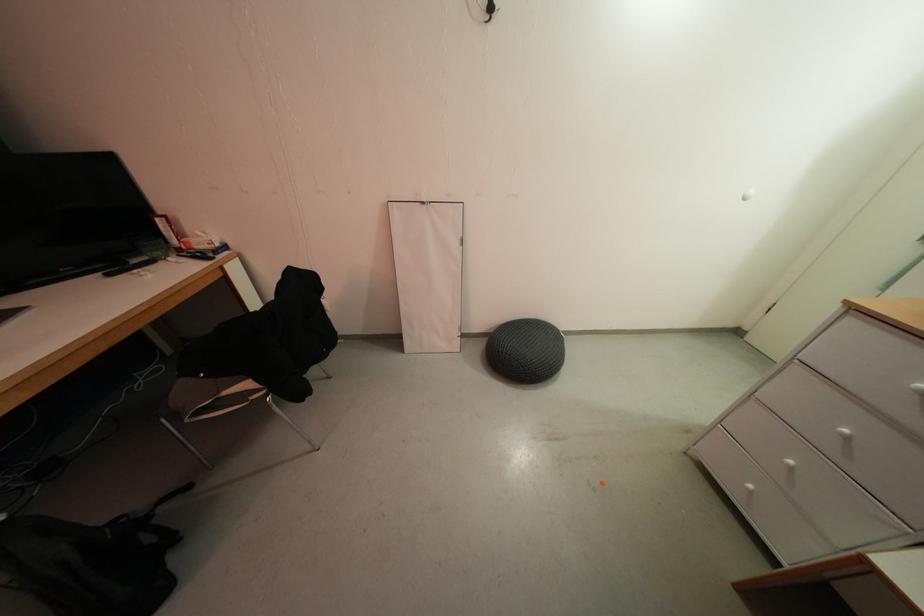
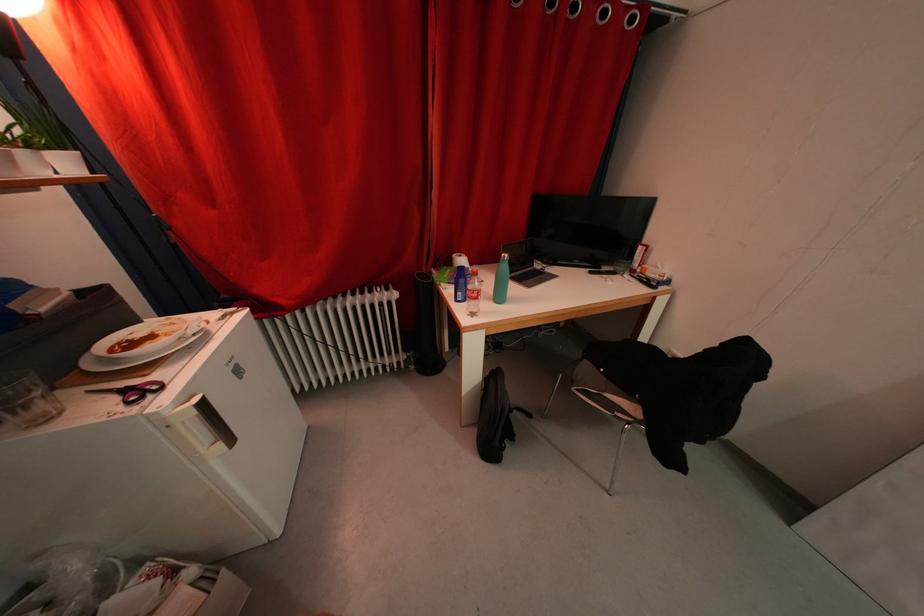
In the second image, find the point that corresponds to (x=130, y=578) in the first image.

(500, 432)